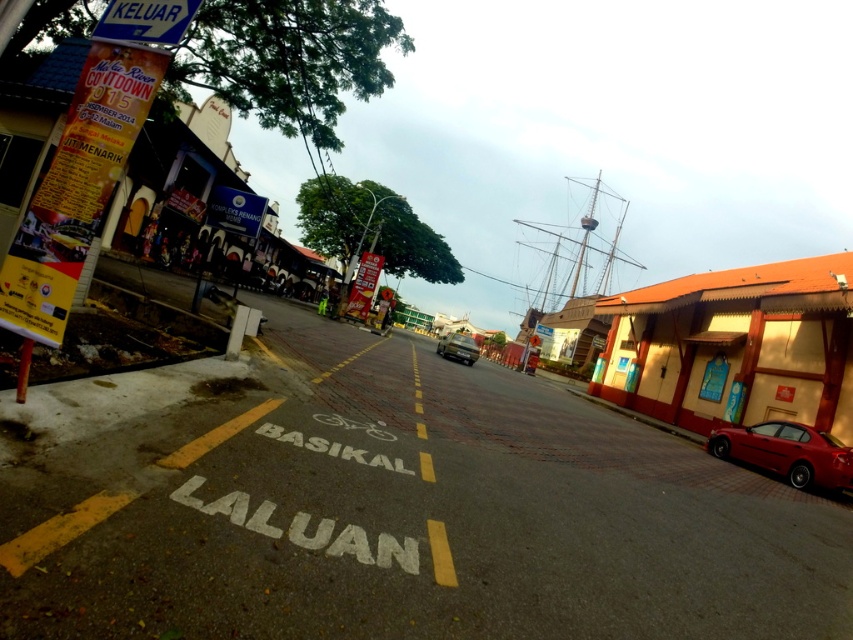
Question: Which point is closer to the camera taking this photo?

Choices:
 (A) (445, 336)
 (B) (770, 435)

Answer: (B)

Question: Can you confirm if shiny red car at lower right is smaller than metallic silver car at center?

Choices:
 (A) yes
 (B) no

Answer: (A)

Question: Is shiny red car at lower right smaller than metallic silver car at center?

Choices:
 (A) yes
 (B) no

Answer: (A)

Question: Does shiny red car at lower right have a larger size compared to metallic silver car at center?

Choices:
 (A) no
 (B) yes

Answer: (A)

Question: Which point is farther to the camera?

Choices:
 (A) shiny red car at lower right
 (B) metallic silver car at center

Answer: (B)